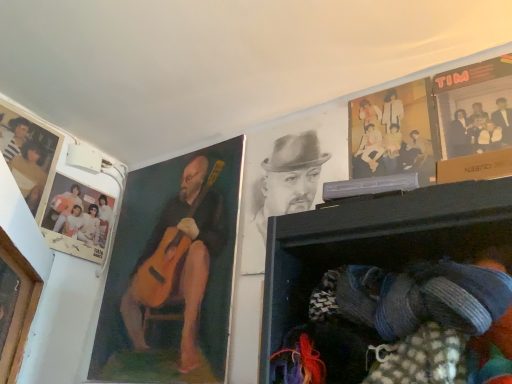
This screenshot has height=384, width=512. Describe the element at coordinates (179, 258) in the screenshot. I see `wooden guitar at left, the 2th man in the right-to-left sequence` at that location.

What do you see at coordinates (283, 191) in the screenshot? I see `black paper portrait at upper center, which is the 2th man in left-to-right order` at bounding box center [283, 191].

This screenshot has width=512, height=384. Describe the element at coordinates (18, 309) in the screenshot. I see `wooden frame at left` at that location.

Find the location of a particular element. The height and width of the screenshot is (384, 512). matte plastic picture frame at upper left is located at coordinates (77, 219).

Measure the distance between matte plastic picture frame at upper left and camera.

The depth of matte plastic picture frame at upper left is 4.75 feet.

Find the location of a particular element. This screenshot has height=384, width=512. knitted fabric at lower right is located at coordinates (390, 284).

Which object is further away from the camera taking this photo, matte paper poster at upper right, the 1th poster page in the right-to-left sequence, or pastel yellow fabric at upper right?

pastel yellow fabric at upper right is more distant.

Which object is positioned more to the left, matte paper poster at upper right, the second poster page positioned from the back, or pastel yellow fabric at upper right?

From the viewer's perspective, pastel yellow fabric at upper right appears more on the left side.

Is matte paper poster at upper right, the first poster page in the front-to-back sequence, positioned with its back to pastel yellow fabric at upper right?

No.

How distant is matte paper poster at upper right, the second poster page positioned from the back, from pastel yellow fabric at upper right?

matte paper poster at upper right, the second poster page positioned from the back, and pastel yellow fabric at upper right are 4.51 inches apart from each other.

Considering the relative sizes of wooden frame at left and wooden guitar at left, the 2th man in the right-to-left sequence, in the image provided, is wooden frame at left smaller than wooden guitar at left, the 2th man in the right-to-left sequence,?

Correct, wooden frame at left occupies less space than wooden guitar at left, the 2th man in the right-to-left sequence.

From the picture: Is wooden frame at left turned away from wooden guitar at left, which appears as the first man when viewed from the left?

No, wooden frame at left is not facing away from wooden guitar at left, which appears as the first man when viewed from the left.

Considering the relative sizes of wooden frame at left and wooden guitar at left, which appears as the first man when viewed from the left, in the image provided, is wooden frame at left wider than wooden guitar at left, which appears as the first man when viewed from the left,?

Indeed, wooden frame at left has a greater width compared to wooden guitar at left, which appears as the first man when viewed from the left.

Considering the points (25, 285) and (153, 239), which point is in front, point (25, 285) or point (153, 239)?

Positioned in front is point (25, 285).

Considering the relative sizes of knitted fabric at lower right and matte paper photo at upper left, placed as the second poster page when sorted from front to back, in the image provided, is knitted fabric at lower right taller than matte paper photo at upper left, placed as the second poster page when sorted from front to back,?

In fact, knitted fabric at lower right may be shorter than matte paper photo at upper left, placed as the second poster page when sorted from front to back.

Could matte paper photo at upper left, placed as the second poster page when sorted from front to back, be considered to be inside knitted fabric at lower right?

No, matte paper photo at upper left, placed as the second poster page when sorted from front to back, is not inside knitted fabric at lower right.

Does wooden frame at left touch matte paper poster at upper right, arranged as the second poster page when viewed from the left?

No, wooden frame at left is not beside matte paper poster at upper right, arranged as the second poster page when viewed from the left.

Is wooden frame at left oriented towards matte paper poster at upper right, the second poster page positioned from the back?

No.

Considering the positions of objects wooden frame at left and matte paper poster at upper right, the second poster page positioned from the back, in the image provided, who is more to the right, wooden frame at left or matte paper poster at upper right, the second poster page positioned from the back,?

matte paper poster at upper right, the second poster page positioned from the back, is more to the right.

The height and width of the screenshot is (384, 512). In order to click on poster page on the right of wooden frame at left in this screenshot , I will do `click(474, 108)`.

From a real-world perspective, does matte paper photo at upper left, placed as the second poster page when sorted from front to back, stand above wooden frame at left?

Yes, from a real-world perspective, matte paper photo at upper left, placed as the second poster page when sorted from front to back, is over wooden frame at left

Can you tell me how much matte paper photo at upper left, the 1th poster page from the back, and wooden frame at left differ in facing direction?

50.5 degrees separate the facing orientations of matte paper photo at upper left, the 1th poster page from the back, and wooden frame at left.

Does point (15, 144) come closer to viewer compared to point (22, 331)?

No, (15, 144) is further to viewer.

Which of these two, matte paper photo at upper left, which is the first poster page in left-to-right order, or wooden frame at left, stands taller?

With more height is matte paper photo at upper left, which is the first poster page in left-to-right order.

Would you say black paper portrait at upper center, which is the 2th man in left-to-right order, is part of pastel yellow fabric at upper right's contents?

No.

From a real-world perspective, which object rests below the other?

In real-world perspective, black paper portrait at upper center, which is the 2th man in left-to-right order, is lower.

Based on the photo, does pastel yellow fabric at upper right have a lesser width compared to black paper portrait at upper center, the 1th man in the right-to-left sequence?

Yes, pastel yellow fabric at upper right is thinner than black paper portrait at upper center, the 1th man in the right-to-left sequence.

Is pastel yellow fabric at upper right outside of matte paper photo at upper left, the 1th poster page from the back?

Yes, pastel yellow fabric at upper right is located beyond the bounds of matte paper photo at upper left, the 1th poster page from the back.

Looking at this image, which of these two, pastel yellow fabric at upper right or matte paper photo at upper left, placed as the second poster page when sorted from front to back, is smaller?

pastel yellow fabric at upper right is smaller.

Considering the relative sizes of pastel yellow fabric at upper right and matte paper photo at upper left, placed as the second poster page when sorted from front to back, in the image provided, is pastel yellow fabric at upper right shorter than matte paper photo at upper left, placed as the second poster page when sorted from front to back,?

Correct, pastel yellow fabric at upper right is not as tall as matte paper photo at upper left, placed as the second poster page when sorted from front to back.

Image resolution: width=512 pixels, height=384 pixels. What are the coordinates of `poster page on the right side of pastel yellow fabric at upper right` in the screenshot? It's located at (474, 108).

From the image's perspective, which man is the 1st one above the wooden frame at left? Please provide its 2D coordinates.

[(179, 258)]

Considering their positions, is knitted fabric at lower right positioned closer to black paper portrait at upper center, which is the 2th man in left-to-right order, than wooden frame at left?

knitted fabric at lower right lies closer to black paper portrait at upper center, which is the 2th man in left-to-right order, than the other object.

Based on their spatial positions, is matte paper photo at upper left, which is the first poster page in left-to-right order, or wooden guitar at left, which appears as the first man when viewed from the left, closer to matte paper poster at upper right, the 1th poster page in the right-to-left sequence?

The object closer to matte paper poster at upper right, the 1th poster page in the right-to-left sequence, is wooden guitar at left, which appears as the first man when viewed from the left.

Which object lies nearer to the anchor point black paper portrait at upper center, the 1th man in the right-to-left sequence, wooden frame at left or matte paper photo at upper left, the 1th poster page from the back?

Based on the image, wooden frame at left appears to be nearer to black paper portrait at upper center, the 1th man in the right-to-left sequence.

Based on the photo, when comparing their distances from wooden guitar at left, the 2th man in the right-to-left sequence, does pastel yellow fabric at upper right or knitted fabric at lower right seem further?

knitted fabric at lower right is further to wooden guitar at left, the 2th man in the right-to-left sequence.

Estimate the real-world distances between objects in this image. Which object is further from knitted fabric at lower right, matte paper poster at upper right, the first poster page in the front-to-back sequence, or wooden frame at left?

Among the two, wooden frame at left is located further to knitted fabric at lower right.

Considering their positions, is pastel yellow fabric at upper right positioned further to knitted fabric at lower right than matte paper photo at upper left, which is the first poster page in left-to-right order?

Among the two, matte paper photo at upper left, which is the first poster page in left-to-right order, is located further to knitted fabric at lower right.

Looking at the image, which one is located closer to matte paper poster at upper right, arranged as the second poster page when viewed from the left, matte plastic picture frame at upper left or black paper portrait at upper center, which is the 2th man in left-to-right order?

Among the two, black paper portrait at upper center, which is the 2th man in left-to-right order, is located nearer to matte paper poster at upper right, arranged as the second poster page when viewed from the left.

From the image, which object appears to be farther from matte plastic picture frame at upper left, wooden frame at left or pastel yellow fabric at upper right?

pastel yellow fabric at upper right lies further to matte plastic picture frame at upper left than the other object.

Locate an element on the screen. The width and height of the screenshot is (512, 384). person situated between black paper portrait at upper center, the 1th man in the right-to-left sequence, and matte paper poster at upper right, the first poster page in the front-to-back sequence, from left to right is located at coordinates (393, 133).

Where is `person situated between matte plastic picture frame at upper left and matte paper poster at upper right, arranged as the second poster page when viewed from the left, from left to right`? The width and height of the screenshot is (512, 384). person situated between matte plastic picture frame at upper left and matte paper poster at upper right, arranged as the second poster page when viewed from the left, from left to right is located at coordinates (393, 133).

Find the location of a particular element. The image size is (512, 384). portrait situated between matte paper photo at upper left, which is the first poster page in left-to-right order, and black paper portrait at upper center, which is the 2th man in left-to-right order, from left to right is located at coordinates (18, 309).

Find the location of `person between knitted fabric at lower right and wooden guitar at left, the 2th man in the right-to-left sequence, in the front-back direction`. person between knitted fabric at lower right and wooden guitar at left, the 2th man in the right-to-left sequence, in the front-back direction is located at coordinates (393, 133).